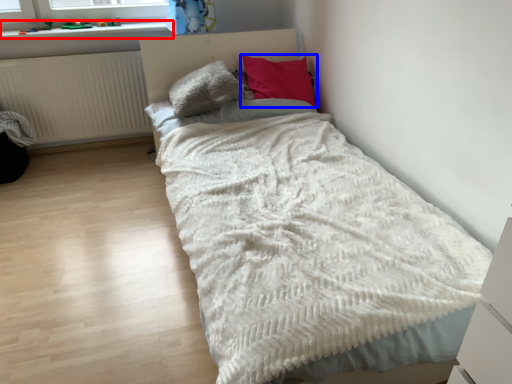
Question: Which of the following is the closest to the observer, window sill (highlighted by a red box) or pillow (highlighted by a blue box)?

Choices:
 (A) window sill
 (B) pillow

Answer: (B)